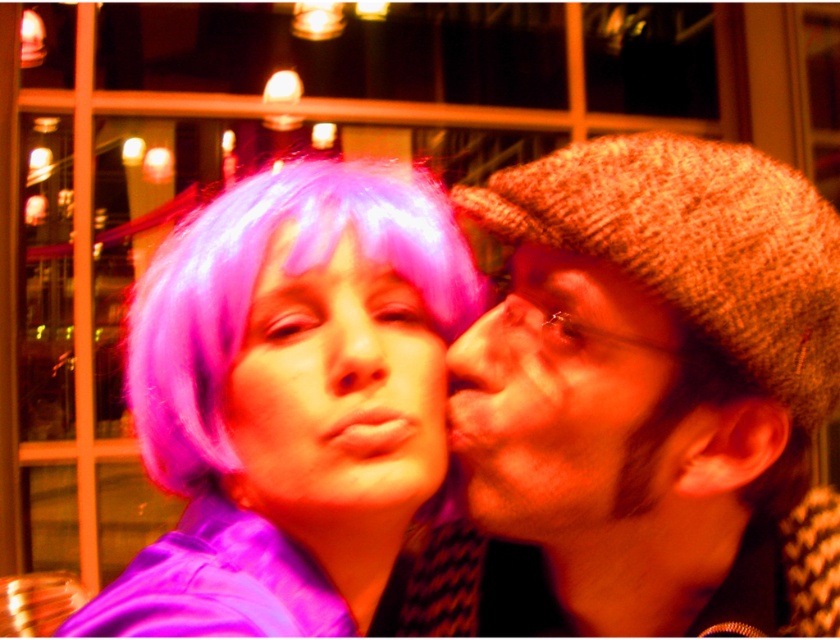
Question: Which point is farther to the camera?

Choices:
 (A) smooth brown hat at right
 (B) matte pink nose at center

Answer: (A)

Question: Does purple wig at center appear over matte brown nose at center?

Choices:
 (A) no
 (B) yes

Answer: (A)

Question: Which of the following is the farthest from the observer?

Choices:
 (A) (318, 227)
 (B) (273, 417)
 (C) (534, 436)

Answer: (A)

Question: Does purple synthetic wig at upper left lie behind matte brown nose at center?

Choices:
 (A) no
 (B) yes

Answer: (A)

Question: Which object is closer to the camera taking this photo?

Choices:
 (A) knitted wool cap at upper right
 (B) matte pink nose at center
 (C) smooth brown hat at right

Answer: (A)

Question: Can you confirm if purple synthetic wig at upper left is positioned above matte brown nose at center?

Choices:
 (A) no
 (B) yes

Answer: (A)